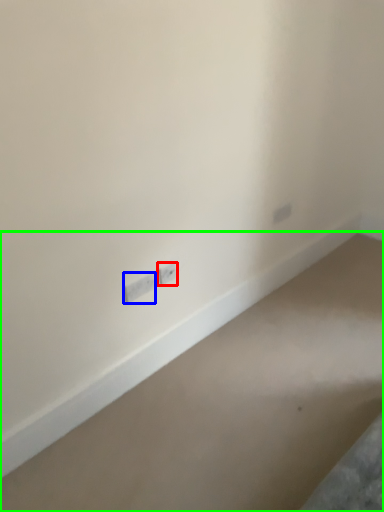
Question: Considering the real-world distances, which object is closest to power plugs and sockets (highlighted by a red box)? power plugs and sockets (highlighted by a blue box) or concrete (highlighted by a green box).

Choices:
 (A) power plugs and sockets
 (B) concrete

Answer: (A)